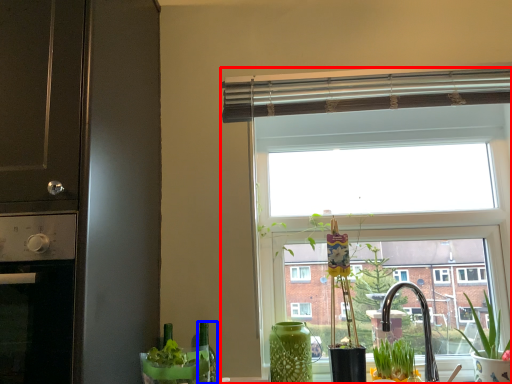
Question: Among these objects, which one is farthest to the camera, window (highlighted by a red box) or bottle (highlighted by a blue box)?

Choices:
 (A) window
 (B) bottle

Answer: (A)